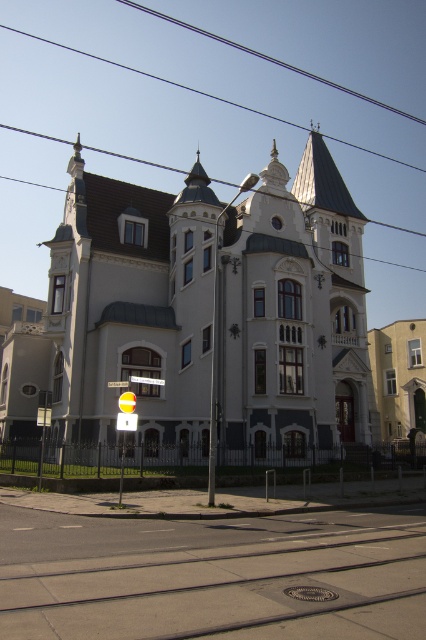
Question: Which point is closer to the camera taking this photo?

Choices:
 (A) (149, 381)
 (B) (8, 129)

Answer: (A)

Question: Which of these objects is positioned closest to the white plastic street sign at center?

Choices:
 (A) metallic wire at upper center
 (B) white plastic street sign at upper center

Answer: (B)

Question: Is white plastic street sign at center wider than white plastic street sign at upper center?

Choices:
 (A) no
 (B) yes

Answer: (A)

Question: Estimate the real-world distances between objects in this image. Which object is farther from the white plastic street sign at upper center?

Choices:
 (A) white plastic street sign at center
 (B) metallic wire at upper center

Answer: (B)

Question: Can you confirm if metallic wire at upper center is positioned below white plastic street sign at center?

Choices:
 (A) yes
 (B) no

Answer: (B)

Question: Does white plastic street sign at center appear over white plastic street sign at upper center?

Choices:
 (A) yes
 (B) no

Answer: (B)